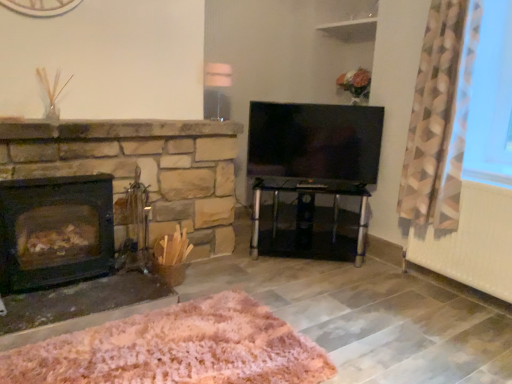
Question: Is geometric-patterned fabric at right spatially inside pink fluffy rug at lower center, or outside of it?

Choices:
 (A) inside
 (B) outside

Answer: (B)

Question: Based on their sizes in the image, would you say geometric-patterned fabric at right is bigger or smaller than pink fluffy rug at lower center?

Choices:
 (A) big
 (B) small

Answer: (A)

Question: Which is nearer to the white painted radiator at lower right?

Choices:
 (A) pink fluffy rug at lower center
 (B) flat-screen tv at center
 (C) transparent glass table at center
 (D) black matte wood burning stove at left
 (E) geometric-patterned fabric at right

Answer: (E)

Question: Estimate the real-world distances between objects in this image. Which object is closer to the pink fluffy rug at lower center?

Choices:
 (A) white painted radiator at lower right
 (B) flat-screen tv at center
 (C) black matte wood burning stove at left
 (D) transparent glass table at center
 (E) geometric-patterned fabric at right

Answer: (C)